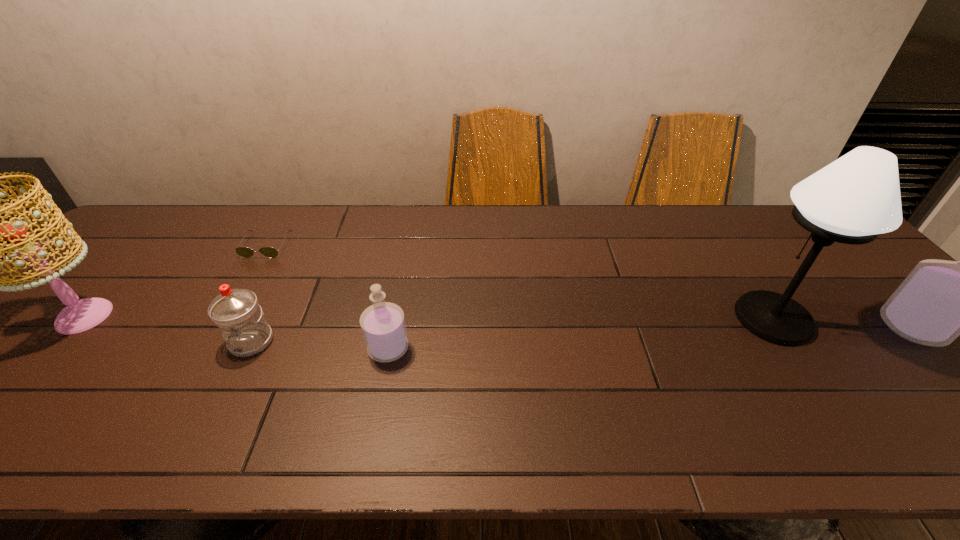
I want to click on empty space between the farthest object and the table lamp, so click(x=520, y=282).

I want to click on empty space between the second object from right to left and the leftmost object, so click(x=429, y=318).

Where is `empty location between the water bottle and the farthest object`? The image size is (960, 540). empty location between the water bottle and the farthest object is located at coordinates (259, 294).

Locate an element on the screen. The width and height of the screenshot is (960, 540). free space between the fifth object from left to right and the leftmost object is located at coordinates (429, 318).

This screenshot has height=540, width=960. What are the coordinates of `object that stands as the third closest to the table lamp` in the screenshot? It's located at (244, 328).

Identify which object is located as the nearest to the water bottle. Please provide its 2D coordinates. Your answer should be formatted as a tuple, i.e. [(x, y)], where the tuple contains the x and y coordinates of a point satisfying the conditions above.

[(383, 326)]

At what (x,y) coordinates should I click in order to perform the action: click on vacant space that satisfies the following two spatial constraints: 1. on the handle side of the water bottle; 2. on the left side of the fourth object from left to right. Please return your answer as a coordinate pair (x, y). Looking at the image, I should click on (249, 348).